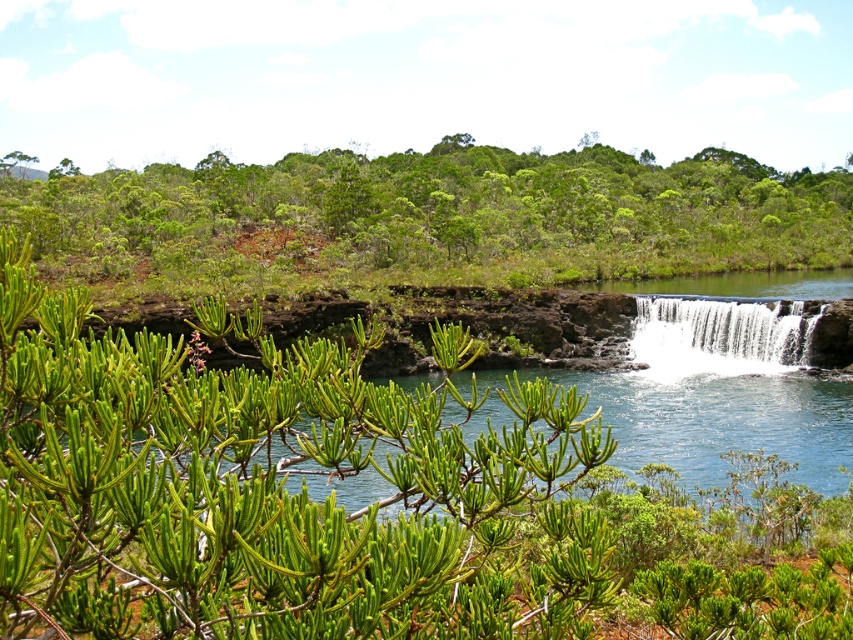
Is green leafy shrub at center smaller than white frothy water at lower right?

Incorrect, green leafy shrub at center is not smaller in size than white frothy water at lower right.

Is green leafy shrub at center further to the viewer compared to white frothy water at lower right?

That is False.

The width and height of the screenshot is (853, 640). Identify the location of green leafy shrub at center. (277, 486).

Find the location of a particular element. The width and height of the screenshot is (853, 640). green leafy shrub at center is located at coordinates (277, 486).

Where is `green leafy shrub at center`? The width and height of the screenshot is (853, 640). green leafy shrub at center is located at coordinates click(277, 486).

The height and width of the screenshot is (640, 853). What are the coordinates of `green leafy shrub at center` in the screenshot? It's located at (277, 486).

What do you see at coordinates (277, 486) in the screenshot? Image resolution: width=853 pixels, height=640 pixels. I see `green leafy shrub at center` at bounding box center [277, 486].

Who is taller, green leafy shrub at center or green matte tree at upper left?

green matte tree at upper left

What do you see at coordinates (277, 486) in the screenshot?
I see `green leafy shrub at center` at bounding box center [277, 486].

You are a GUI agent. You are given a task and a screenshot of the screen. Output one action in this format:
    pyautogui.click(x=<x>, y=<y>)
    Task: Click on the green leafy shrub at center
    
    Given the screenshot: What is the action you would take?
    pyautogui.click(x=277, y=486)